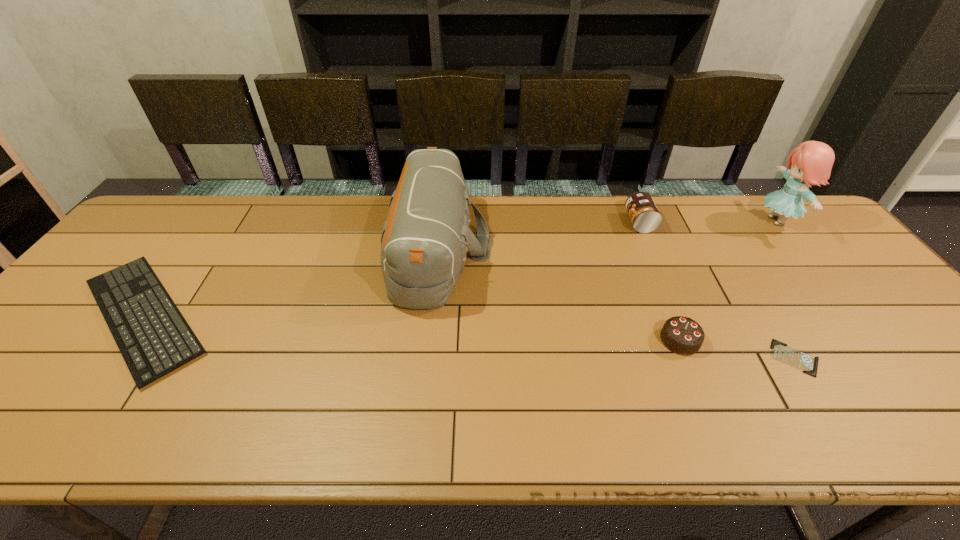
Identify the location of object located at the right edge. (811, 162).

This screenshot has height=540, width=960. Identify the location of object located in the far right corner section of the desktop. (811, 162).

The image size is (960, 540). Identify the location of vacant region at the far edge of the desktop. (228, 197).

Locate an element on the screen. The image size is (960, 540). free spot at the near edge of the desktop is located at coordinates (854, 433).

Find the location of a particular element. The image size is (960, 540). vacant space at the left edge of the desktop is located at coordinates (76, 299).

Where is `free region at the right edge of the desktop`? The width and height of the screenshot is (960, 540). free region at the right edge of the desktop is located at coordinates (900, 381).

Find the location of a particular element. The width and height of the screenshot is (960, 540). vacant space at the far left corner of the desktop is located at coordinates [148, 217].

You are a GUI agent. You are given a task and a screenshot of the screen. Output one action in this format:
    pyautogui.click(x=<x>, y=<y>)
    Task: Click on the vacant area that lies between the fourth shortest object and the duffel bag
    
    Given the screenshot: What is the action you would take?
    pyautogui.click(x=540, y=235)

This screenshot has width=960, height=540. What are the coordinates of `free point between the chocolate cake and the third tallest object` in the screenshot? It's located at (660, 281).

Locate an element on the screen. This screenshot has width=960, height=540. free space between the fifth object from right to left and the third shortest object is located at coordinates (559, 294).